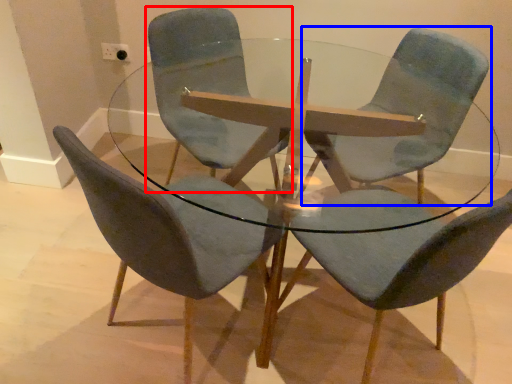
Question: Which point is closer to the camera, chair (highlighted by a red box) or chair (highlighted by a blue box)?

Choices:
 (A) chair
 (B) chair

Answer: (A)